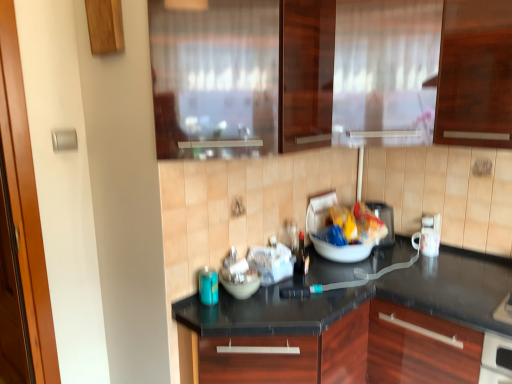
The height and width of the screenshot is (384, 512). I want to click on free point to the left of white glossy mug at right, the first appliance when ordered from right to left, so click(399, 251).